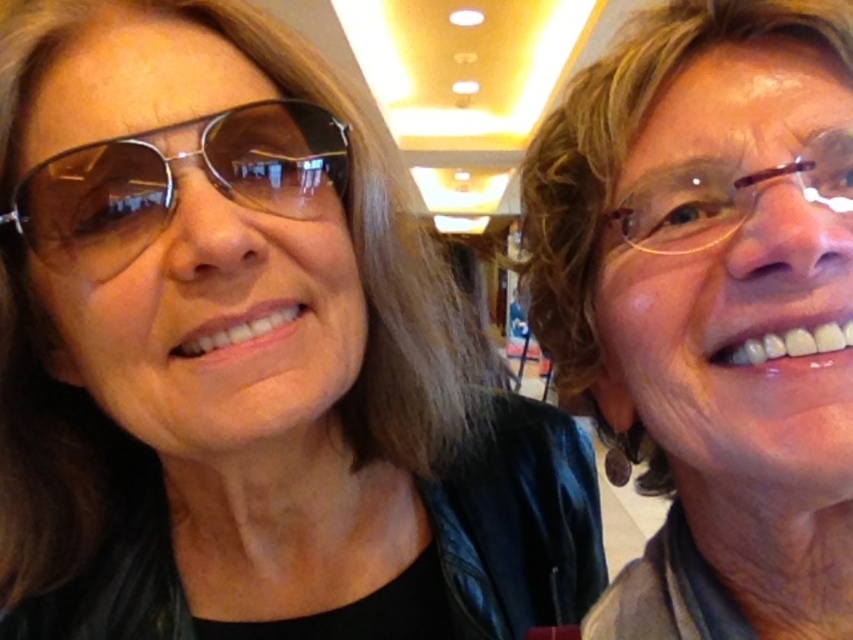
You are standing in the shopping mall and see two people. The person on the left is wearing a shiny leather jacket, and the person on the right has a point at coordinates [711,307]. What is the texture of the area where the point is located on the person on the right?

The point at [711,307] is on the matte black jacket at right, so the texture there is matte.

Consider the image. You are a fashion designer observing the two items at the right side of the image, the matte black jacket at right and the brown plastic glasses at right. Which item would require more fabric to create?

The matte black jacket at right is bigger than the brown plastic glasses at right, so it would require more fabric to create.

From the picture: You are standing in a shopping mall and want to take a photo of the scene. Your camera has a minimum focus distance of 20 inches. Can you focus on the point at coordinates point (361,618) without moving closer?

The distance between point (361,618) and the camera is 21.62 inches, which is greater than the minimum focus distance of 20 inches. Therefore, you can focus on the point at coordinates point (361,618) without moving closer.